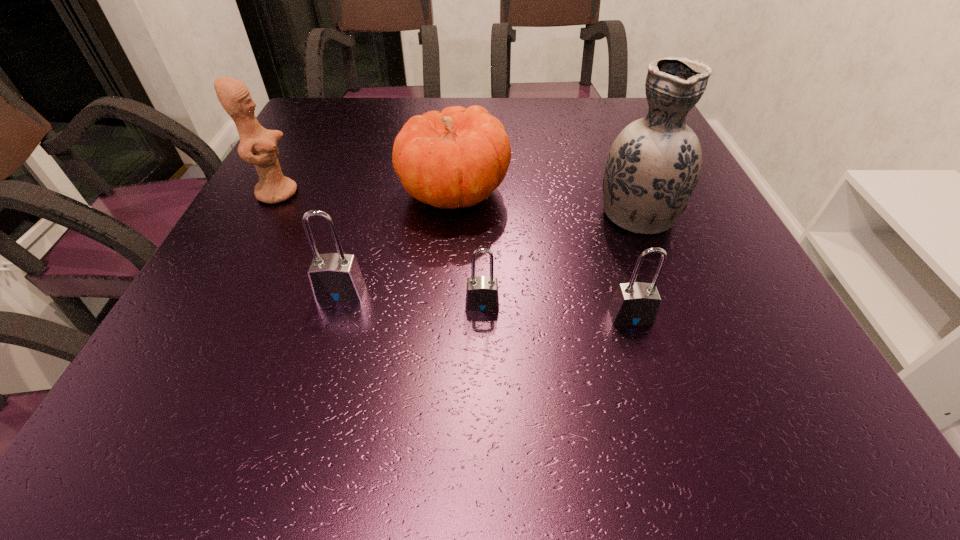
Locate an element on the screen. free point at the near edge is located at coordinates (517, 335).

In the image, there is a desktop. Where is `vacant space at the left edge`? This screenshot has height=540, width=960. vacant space at the left edge is located at coordinates (264, 217).

You are a GUI agent. You are given a task and a screenshot of the screen. Output one action in this format:
    pyautogui.click(x=<x>, y=<y>)
    Task: Click on the free space at the far left corner
    This screenshot has height=540, width=960.
    Given the screenshot: What is the action you would take?
    pyautogui.click(x=333, y=99)

Image resolution: width=960 pixels, height=540 pixels. In the image, there is a desktop. What are the coordinates of `vacant space at the far right corner` in the screenshot? It's located at (627, 124).

Identify the location of blank region between the pumpkin and the second shortest padlock. (542, 253).

The height and width of the screenshot is (540, 960). Identify the location of vacant space that is in between the tallest object and the pumpkin. (545, 201).

The width and height of the screenshot is (960, 540). I want to click on free spot between the rightmost padlock and the second tallest object, so click(x=454, y=254).

You are a GUI agent. You are given a task and a screenshot of the screen. Output one action in this format:
    pyautogui.click(x=<x>, y=<y>)
    Task: Click on the vacant space in between the rightmost padlock and the shortest object
    
    Given the screenshot: What is the action you would take?
    pyautogui.click(x=557, y=310)

You are a GUI agent. You are given a task and a screenshot of the screen. Output one action in this format:
    pyautogui.click(x=<x>, y=<y>)
    Task: Click on the free area in between the pumpkin and the shortest padlock
    The image size is (960, 540).
    Given the screenshot: What is the action you would take?
    pyautogui.click(x=468, y=247)

Locate an element on the screen. empty space that is in between the tallest object and the second tallest padlock is located at coordinates [634, 264].